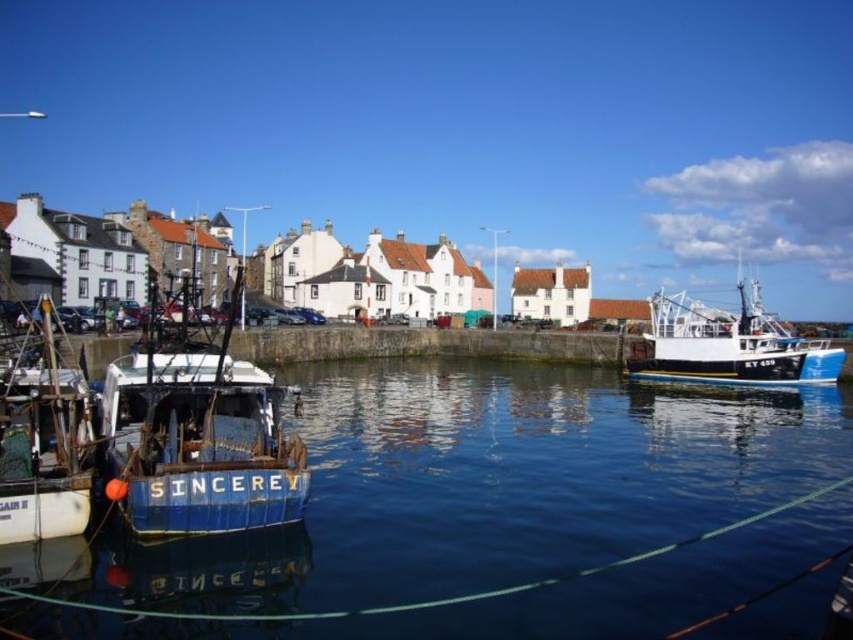
You are standing at the point labeled as point (x=497, y=513) in the harbor scene. What do you see directly in front of you?

You see the blue glossy water at center directly in front of you at point (x=497, y=513).